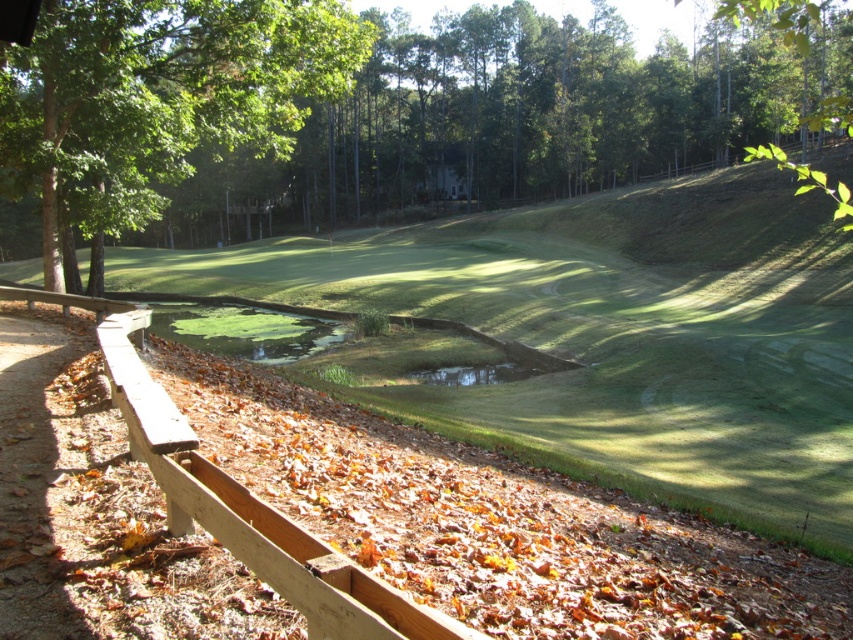
Question: Which point appears farthest from the camera in this image?

Choices:
 (A) (512, 365)
 (B) (149, 388)
 (C) (367, 134)
 (D) (88, 4)

Answer: (C)

Question: In this image, where is green leafy tree at upper center located relative to green leafy tree at upper left?

Choices:
 (A) above
 (B) below

Answer: (A)

Question: Is green leafy tree at upper left bigger than green grass hole at center?

Choices:
 (A) yes
 (B) no

Answer: (A)

Question: Which object is closer to the camera taking this photo?

Choices:
 (A) wooden fence at lower left
 (B) green grass hole at center
 (C) green leafy tree at upper left

Answer: (A)

Question: Is green leafy tree at upper left to the right of green grass hole at center from the viewer's perspective?

Choices:
 (A) yes
 (B) no

Answer: (B)

Question: Which of the following is the farthest from the observer?

Choices:
 (A) wooden fence at lower left
 (B) green leafy tree at upper center
 (C) green grass hole at center
 (D) green leafy tree at upper left

Answer: (C)